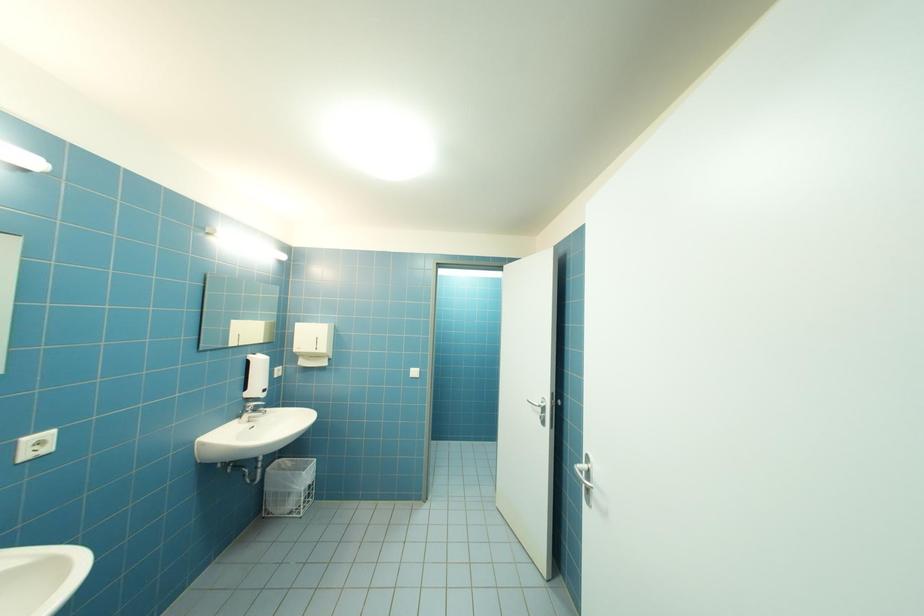
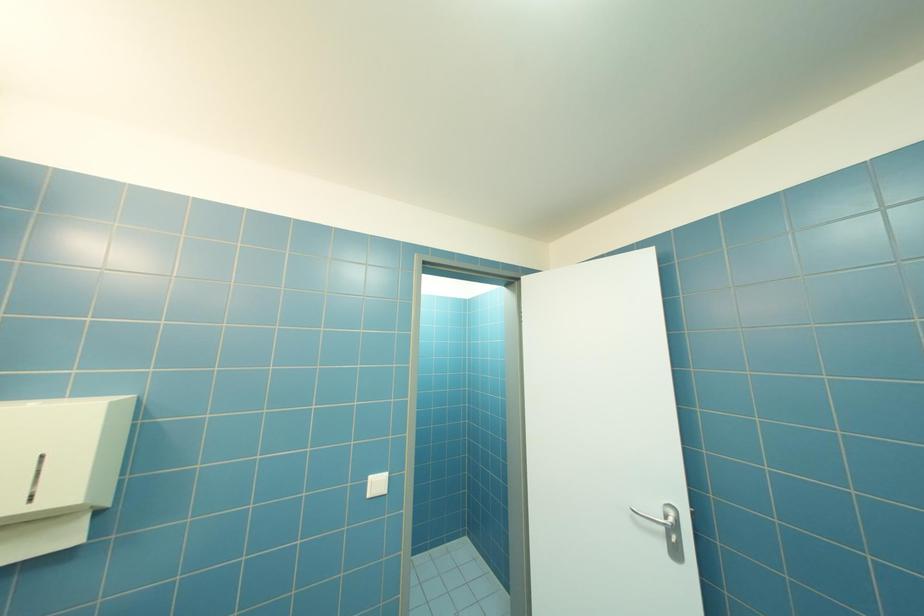
What movement of the cameraman would produce the second image?

The cameraman walked toward left, forward.